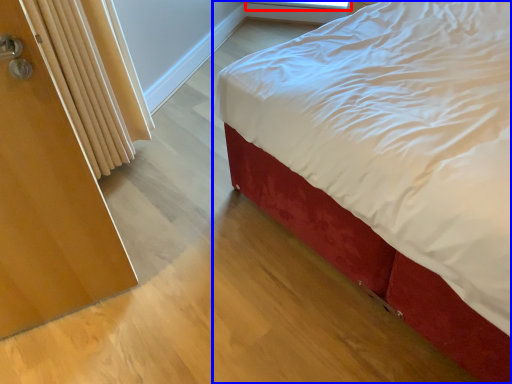
Question: Which of the following is the farthest to the observer, window screen (highlighted by a red box) or bed (highlighted by a blue box)?

Choices:
 (A) window screen
 (B) bed

Answer: (A)